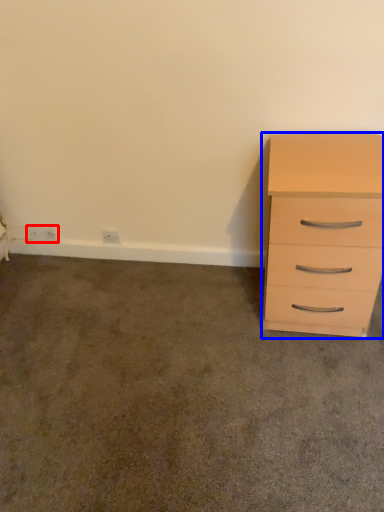
Question: Which point is closer to the camera, electric outlet (highlighted by a red box) or chest of drawers (highlighted by a blue box)?

Choices:
 (A) electric outlet
 (B) chest of drawers

Answer: (B)